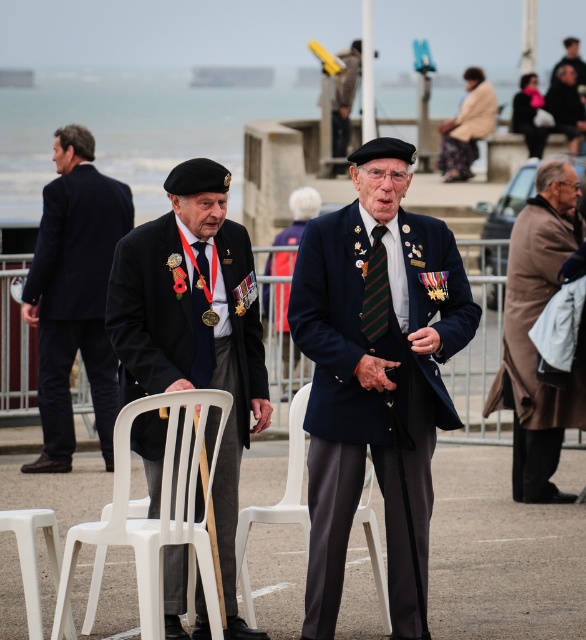
Question: Does dark blue suit at left appear on the left side of white plastic chair at center?

Choices:
 (A) no
 (B) yes

Answer: (B)

Question: Is navy blue fabric jacket at center further to camera compared to light brown woolen coat at upper right?

Choices:
 (A) no
 (B) yes

Answer: (A)

Question: Which is farther from the green striped tie at center?

Choices:
 (A) gold metallic tie at center
 (B) white plastic stool at lower left

Answer: (B)

Question: Considering the real-world distances, which object is farthest from the dark blue suit at left?

Choices:
 (A) gold metallic tie at center
 (B) green striped tie at center
 (C) white plastic folding chair at lower left
 (D) white plastic chair at center

Answer: (C)

Question: Which object is the closest to the light brown woolen coat at upper right?

Choices:
 (A) dark blue uniform at upper right
 (B) gold metallic tie at center
 (C) green striped tie at center

Answer: (A)

Question: Is navy blue fabric jacket at center closer to camera compared to dark blue uniform at upper right?

Choices:
 (A) yes
 (B) no

Answer: (A)